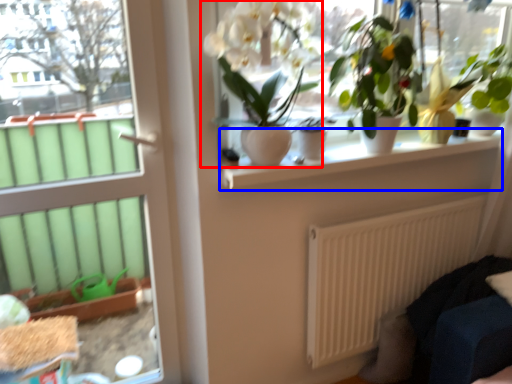
Question: Among these objects, which one is farthest to the camera, houseplant (highlighted by a red box) or window sill (highlighted by a blue box)?

Choices:
 (A) houseplant
 (B) window sill

Answer: (B)